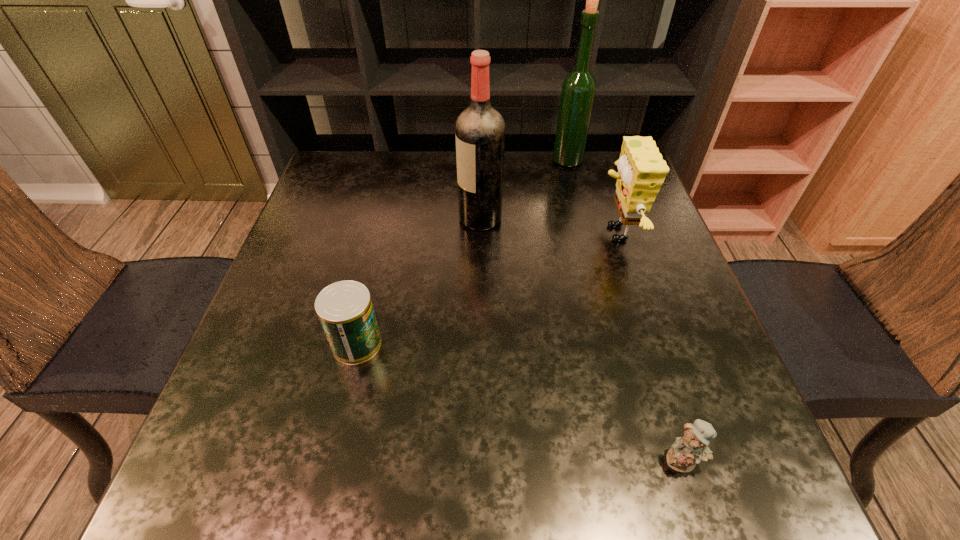
What are the coordinates of `blank region between the leftmost object and the teddy bear` in the screenshot? It's located at (519, 402).

The height and width of the screenshot is (540, 960). I want to click on vacant area between the nearest object and the fourth tallest object, so click(x=519, y=402).

The image size is (960, 540). Find the location of `empty space between the second object from left to right and the sponge`. empty space between the second object from left to right and the sponge is located at coordinates coord(547,226).

At what (x,y) coordinates should I click in order to perform the action: click on free space between the third tallest object and the fourth farthest object. Please return your answer as a coordinate pair (x, y). The height and width of the screenshot is (540, 960). Looking at the image, I should click on (486, 288).

Find the location of `vacant area that lies between the nearest object and the left liquor`. vacant area that lies between the nearest object and the left liquor is located at coordinates (582, 339).

Locate an element on the screen. This screenshot has width=960, height=540. free spot between the nearest object and the third shortest object is located at coordinates (648, 347).

Where is `free area in between the leftmost object and the nearest object`? free area in between the leftmost object and the nearest object is located at coordinates (519, 402).

Find the location of a particular element. free spot between the leftmost object and the third tallest object is located at coordinates (486, 288).

You are a GUI agent. You are given a task and a screenshot of the screen. Output one action in this format:
    pyautogui.click(x=<x>, y=<y>)
    Task: Click on the free space that is in between the farthest object and the fourth tallest object
    This screenshot has width=960, height=540.
    Given the screenshot: What is the action you would take?
    pos(462,252)

This screenshot has height=540, width=960. I want to click on vacant area that lies between the nearest object and the right liquor, so click(x=625, y=310).